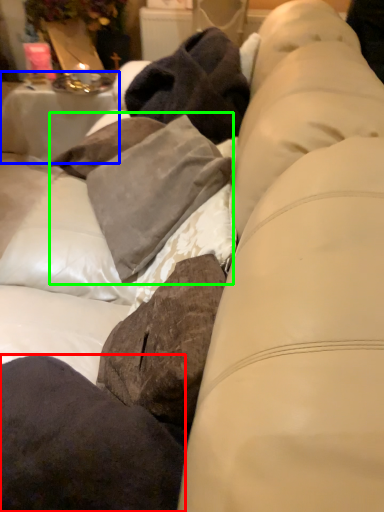
Question: Based on their relative distances, which object is nearer to pillow (highlighted by a red box)? Choose from table (highlighted by a blue box) and clothing (highlighted by a green box).

Choices:
 (A) table
 (B) clothing

Answer: (B)